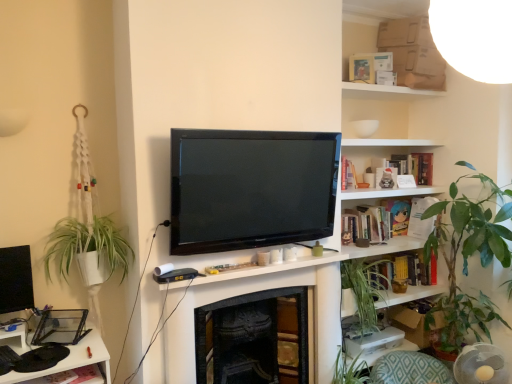
Question: In terms of size, does hardcover book at upper right, placed as the first book when sorted from top to bottom, appear bigger or smaller than wooden bookshelf at upper right?

Choices:
 (A) big
 (B) small

Answer: (B)

Question: From a real-world perspective, relative to wooden bookshelf at upper right, is hardcover book at upper right, marked as the 3th book in a bottom-to-top arrangement, vertically above or below?

Choices:
 (A) above
 (B) below

Answer: (A)

Question: Which object is the farthest from the green leafy plant at right?

Choices:
 (A) green fabric cushion at lower right
 (B) wooden bookshelf at upper right
 (C) hardcover book at upper right, marked as the 3th book in a bottom-to-top arrangement
 (D) hardcover book at center-right, placed as the first book when sorted from bottom to top
 (E) white cardboard box at upper right

Answer: (E)

Question: Which object is the farthest from the hardcover book at upper right, placed as the first book when sorted from top to bottom?

Choices:
 (A) green fabric cushion at lower right
 (B) hardcover book at center-right, marked as the third book in a top-to-bottom arrangement
 (C) white cardboard box at upper right
 (D) green leafy plant at right
 (E) wooden bookshelf at upper right

Answer: (C)